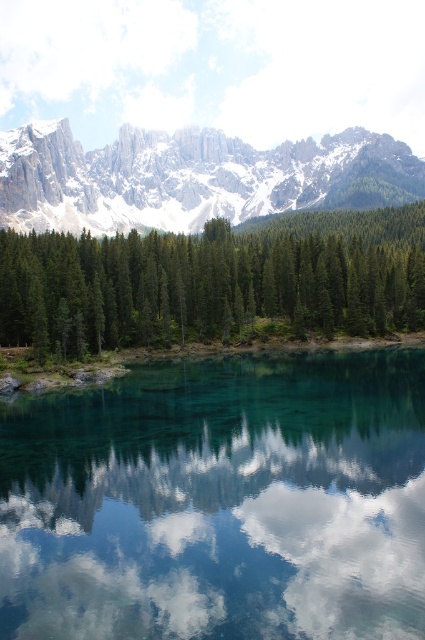
The width and height of the screenshot is (425, 640). Identify the location of transparent glass water at center. (218, 500).

Which is behind, point (376, 557) or point (297, 554)?

Positioned behind is point (297, 554).

Identify the location of transparent glass water at center. (218, 500).

Between transparent glass water at center and green matte trees at center, which one has more height?

green matte trees at center

You are a GUI agent. You are given a task and a screenshot of the screen. Output one action in this format:
    pyautogui.click(x=<x>, y=<y>)
    Task: Click on the transparent glass water at center
    This screenshot has width=425, height=640.
    Given the screenshot: What is the action you would take?
    pyautogui.click(x=218, y=500)

Locate an element on the screen. The height and width of the screenshot is (640, 425). transparent glass water at center is located at coordinates (218, 500).

This screenshot has width=425, height=640. Describe the element at coordinates (209, 282) in the screenshot. I see `green matte trees at center` at that location.

Is green matte trees at center positioned in front of snowy granite mountain range at upper center?

Yes.

Does point (3, 288) come behind point (130, 182)?

No, it is not.

Locate an element on the screen. green matte trees at center is located at coordinates (209, 282).